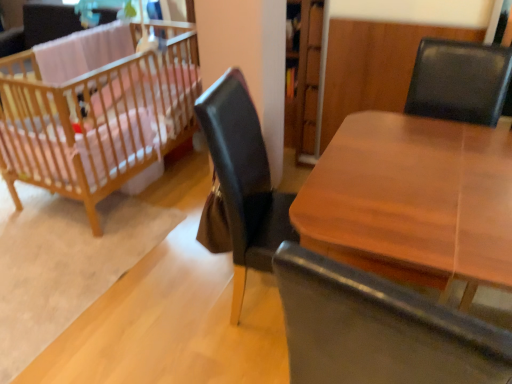
Question: From a real-world perspective, is wooden table at center positioned above or below wooden crib at left?

Choices:
 (A) below
 (B) above

Answer: (A)

Question: Based on their positions, is wooden table at center located to the left or right of wooden crib at left?

Choices:
 (A) left
 (B) right

Answer: (B)

Question: From the image's perspective, relative to wooden crib at left, is wooden table at center above or below?

Choices:
 (A) above
 (B) below

Answer: (B)

Question: From a real-world perspective, is wooden crib at left physically located above or below wooden table at center?

Choices:
 (A) below
 (B) above

Answer: (B)

Question: Choose the correct answer: Is wooden crib at left inside wooden table at center or outside it?

Choices:
 (A) outside
 (B) inside

Answer: (A)

Question: In terms of height, does wooden crib at left look taller or shorter compared to wooden table at center?

Choices:
 (A) tall
 (B) short

Answer: (A)

Question: Is point (69, 188) closer or farther from the camera than point (309, 244)?

Choices:
 (A) closer
 (B) farther

Answer: (B)